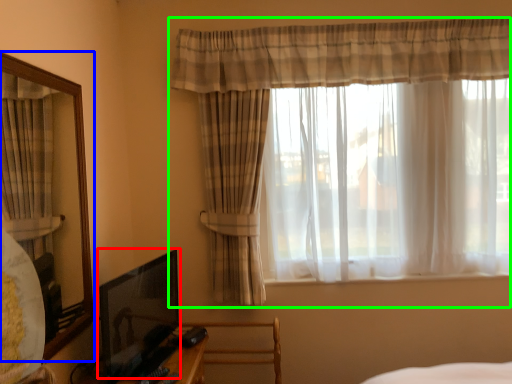
Question: Considering the real-world distances, which object is closest to picture frame (highlighted by a red box)? mirror (highlighted by a blue box) or curtain (highlighted by a green box).

Choices:
 (A) mirror
 (B) curtain

Answer: (A)